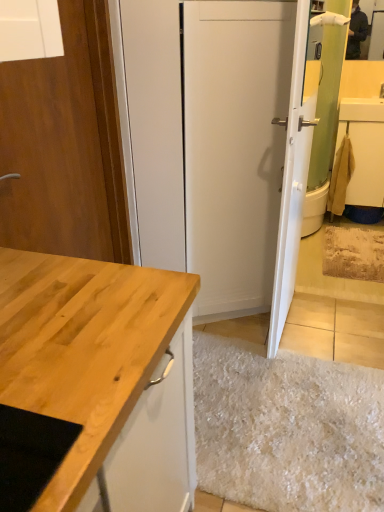
Question: Can you confirm if beige fabric towel at right is thinner than wooden door at left, which is the second door from right to left?

Choices:
 (A) yes
 (B) no

Answer: (B)

Question: Is beige fabric towel at right to the right of wooden door at left, acting as the first door starting from the left, from the viewer's perspective?

Choices:
 (A) yes
 (B) no

Answer: (A)

Question: Can you confirm if beige fabric towel at right is wider than wooden door at left, acting as the first door starting from the left?

Choices:
 (A) no
 (B) yes

Answer: (B)

Question: Is beige fabric towel at right closer to camera compared to wooden door at left, which is the second door from right to left?

Choices:
 (A) yes
 (B) no

Answer: (B)

Question: Is beige fabric towel at right looking in the opposite direction of wooden door at left, acting as the first door starting from the left?

Choices:
 (A) no
 (B) yes

Answer: (A)

Question: Relative to beige fabric towel at right, is wooden door at left, acting as the first door starting from the left, in front or behind?

Choices:
 (A) behind
 (B) front

Answer: (B)

Question: From the image's perspective, relative to beige fabric towel at right, is wooden door at left, acting as the first door starting from the left, above or below?

Choices:
 (A) below
 (B) above

Answer: (A)

Question: Is wooden door at left, acting as the first door starting from the left, inside the boundaries of beige fabric towel at right, or outside?

Choices:
 (A) outside
 (B) inside

Answer: (A)

Question: From their relative heights in the image, would you say wooden door at left, which is the second door from right to left, is taller or shorter than beige fabric towel at right?

Choices:
 (A) tall
 (B) short

Answer: (A)

Question: Is point (309, 125) positioned closer to the camera than point (349, 197)?

Choices:
 (A) farther
 (B) closer

Answer: (B)

Question: Considering their positions, is white glossy door at upper right, which appears as the 1th door when viewed from the right, located in front of or behind beige fabric towel at right?

Choices:
 (A) behind
 (B) front

Answer: (B)

Question: Based on their positions, is white glossy door at upper right, which appears as the 1th door when viewed from the right, located to the left or right of beige fabric towel at right?

Choices:
 (A) right
 (B) left

Answer: (B)

Question: Considering the positions of white glossy door at upper right, which appears as the 1th door when viewed from the right, and beige fabric towel at right in the image, is white glossy door at upper right, which appears as the 1th door when viewed from the right, bigger or smaller than beige fabric towel at right?

Choices:
 (A) big
 (B) small

Answer: (A)

Question: From the image's perspective, is beige fabric towel at right positioned above or below white glossy door at upper right, which appears as the 1th door when viewed from the right?

Choices:
 (A) above
 (B) below

Answer: (A)

Question: Considering their positions, is beige fabric towel at right located in front of or behind white glossy door at upper right, which appears as the 1th door when viewed from the right?

Choices:
 (A) behind
 (B) front

Answer: (A)